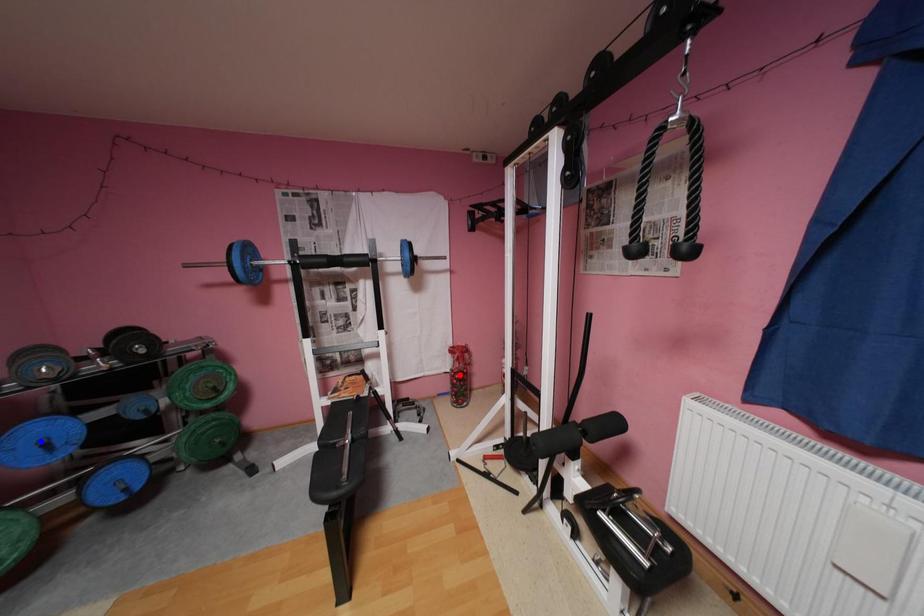
Question: Which of the two points in the image is closer to the camera?

Choices:
 (A) Blue point is closer.
 (B) Red point is closer.

Answer: (A)